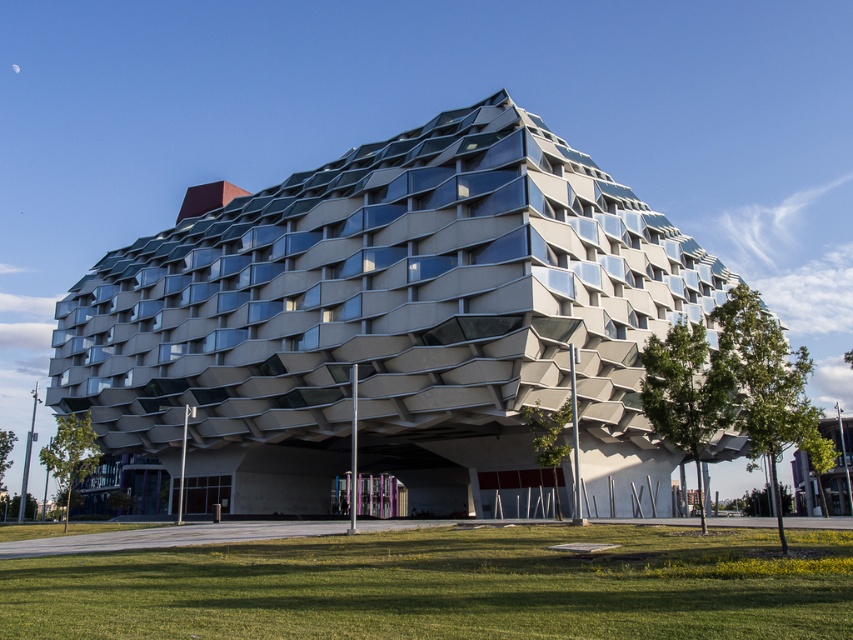
You are standing at the edge of the green grass at lower center and want to walk towards the textured concrete building at center. Which direction should you face to move directly towards the building?

You should face towards the textured concrete building at center, which is located at the center of the image, so facing towards the center from the green grass at lower center would be the correct direction.

You are standing in front of the modern architectural structure and want to take a photo. You notice two points on the building labeled as point [578,289] and point [445,580]. Which point is closer to your camera?

Point [445,580] is closer to the camera than point [578,289] because the description states that point [578,289] is further away.